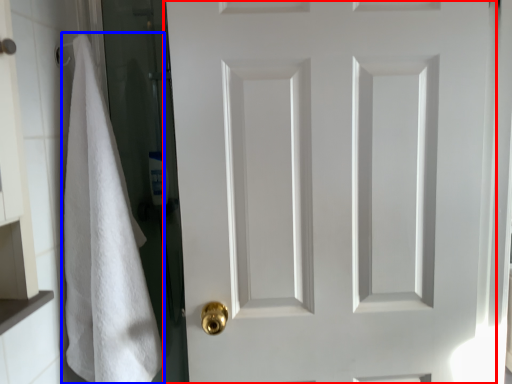
Question: Which point is further to the camera, door (highlighted by a red box) or bath towel (highlighted by a blue box)?

Choices:
 (A) door
 (B) bath towel

Answer: (A)